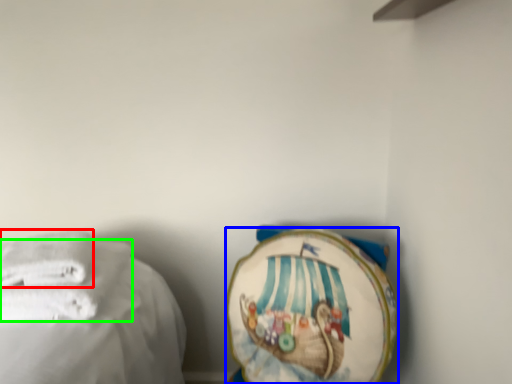
Question: Which object is the farthest from towel (highlighted by a red box)? Choose among these: towel (highlighted by a blue box) or towel (highlighted by a green box).

Choices:
 (A) towel
 (B) towel

Answer: (A)